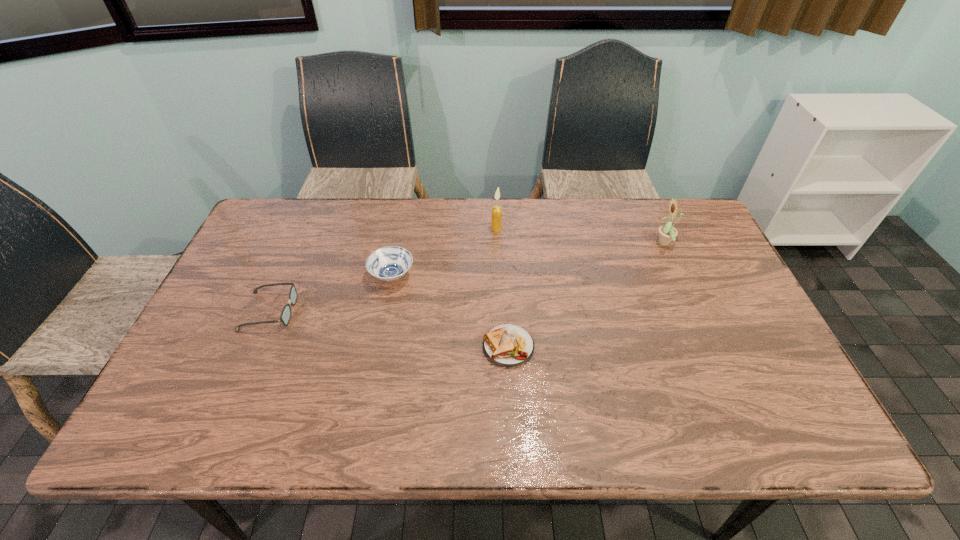
Find the location of a particular element. This screenshot has width=960, height=540. candle is located at coordinates (496, 225).

This screenshot has width=960, height=540. Find the location of `sunflower`. sunflower is located at coordinates (667, 233).

The width and height of the screenshot is (960, 540). Identify the location of the rightmost object. (667, 233).

This screenshot has width=960, height=540. I want to click on the third shortest object, so click(390, 263).

Identify the location of the second object from left to right. tap(390, 263).

Identify the location of the second shortest object. (285, 316).

The image size is (960, 540). Find the location of `the leftmost object`. the leftmost object is located at coordinates (285, 316).

I want to click on sandwich, so 508,345.

Image resolution: width=960 pixels, height=540 pixels. Identify the location of free space located on the left of the farthest object. (433, 229).

Identify the location of vacant space situated 0.150m on the front-facing side of the fourth nearest object. This screenshot has width=960, height=540. (605, 244).